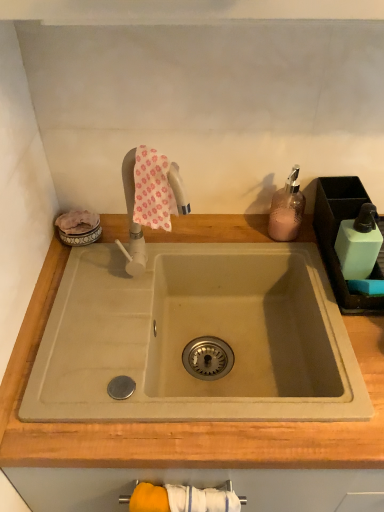
Question: Considering the positions of light green plastic soap dispenser at right and yellow fabric towel bar at lower center in the image, is light green plastic soap dispenser at right wider or thinner than yellow fabric towel bar at lower center?

Choices:
 (A) thin
 (B) wide

Answer: (B)

Question: Relative to yellow fabric towel bar at lower center, is light green plastic soap dispenser at right in front or behind?

Choices:
 (A) front
 (B) behind

Answer: (B)

Question: Estimate the real-world distances between objects in this image. Which object is closer to the pink textured soap dispenser at upper right?

Choices:
 (A) light green plastic soap dispenser at right
 (B) beige wood countertop at center
 (C) yellow fabric towel bar at lower center
 (D) pink floral fabric at upper center

Answer: (A)

Question: Which object is positioned farthest from the beige wood countertop at center?

Choices:
 (A) pink floral fabric at upper center
 (B) light green plastic soap dispenser at right
 (C) pink textured soap dispenser at upper right
 (D) yellow fabric towel bar at lower center

Answer: (C)